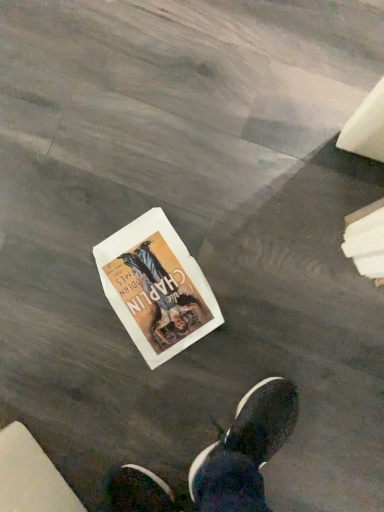
The image size is (384, 512). Find the location of `vacant area situated below white paper at center (from a real-world perspective)`. vacant area situated below white paper at center (from a real-world perspective) is located at coordinates (144, 282).